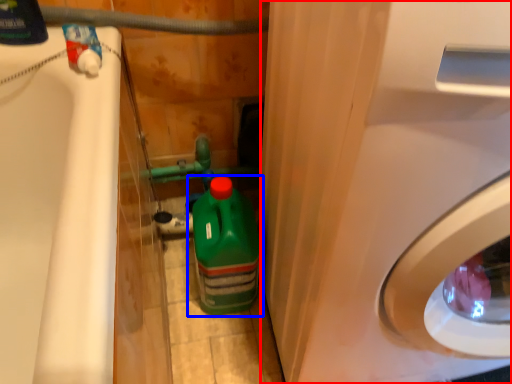
Question: Which object is further to the camera taking this photo, washing machine (highlighted by a red box) or bottle (highlighted by a blue box)?

Choices:
 (A) washing machine
 (B) bottle

Answer: (B)